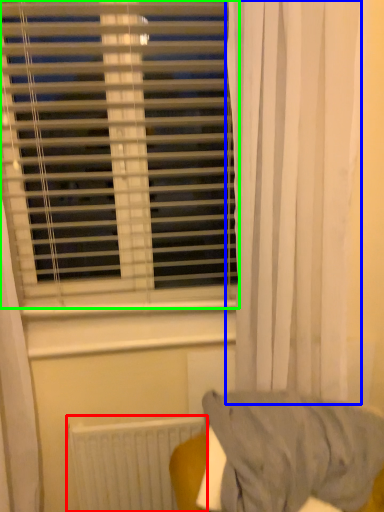
Question: Considering the real-world distances, which object is farthest from radiator (highlighted by a red box)? curtain (highlighted by a blue box) or window blind (highlighted by a green box)?

Choices:
 (A) curtain
 (B) window blind

Answer: (B)